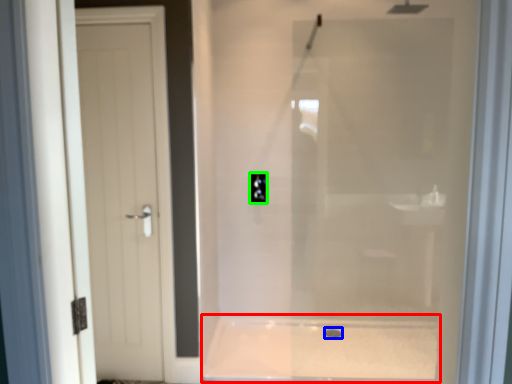
Question: Based on their relative distances, which object is farther from bath (highlighted by a red box)? Choose from drain (highlighted by a blue box) and electric outlet (highlighted by a green box).

Choices:
 (A) drain
 (B) electric outlet

Answer: (B)